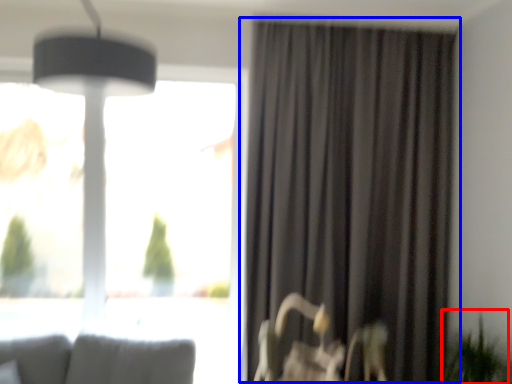
Question: Which of the following is the farthest to the observer, plant (highlighted by a red box) or curtain (highlighted by a blue box)?

Choices:
 (A) plant
 (B) curtain

Answer: (B)